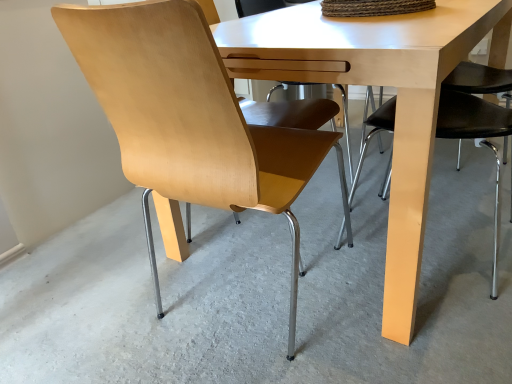
Question: Does light wood table at center have a lesser height compared to light brown wood chair at left?

Choices:
 (A) yes
 (B) no

Answer: (A)

Question: Can we say light wood table at center lies outside light brown wood chair at left?

Choices:
 (A) yes
 (B) no

Answer: (A)

Question: Does light wood table at center have a larger size compared to light brown wood chair at left?

Choices:
 (A) yes
 (B) no

Answer: (A)

Question: Can you confirm if light wood table at center is positioned to the right of light brown wood chair at left?

Choices:
 (A) yes
 (B) no

Answer: (A)

Question: Does light wood table at center have a smaller size compared to light brown wood chair at left?

Choices:
 (A) yes
 (B) no

Answer: (B)

Question: Is light wood table at center oriented towards light brown wood chair at left?

Choices:
 (A) no
 (B) yes

Answer: (A)

Question: Is light brown wood chair at left closer to the viewer compared to light wood table at center?

Choices:
 (A) no
 (B) yes

Answer: (B)

Question: Is light wood table at center inside light brown wood chair at left?

Choices:
 (A) yes
 (B) no

Answer: (B)

Question: From the image's perspective, is light brown wood chair at left located beneath light wood table at center?

Choices:
 (A) no
 (B) yes

Answer: (B)

Question: Can you confirm if light brown wood chair at left is thinner than light wood table at center?

Choices:
 (A) yes
 (B) no

Answer: (A)

Question: Does light brown wood chair at left have a smaller size compared to light wood table at center?

Choices:
 (A) yes
 (B) no

Answer: (A)

Question: Does light brown wood chair at left come behind light wood table at center?

Choices:
 (A) no
 (B) yes

Answer: (A)

Question: Considering the positions of light wood table at center and light brown wood chair at left in the image, is light wood table at center wider or thinner than light brown wood chair at left?

Choices:
 (A) thin
 (B) wide

Answer: (B)